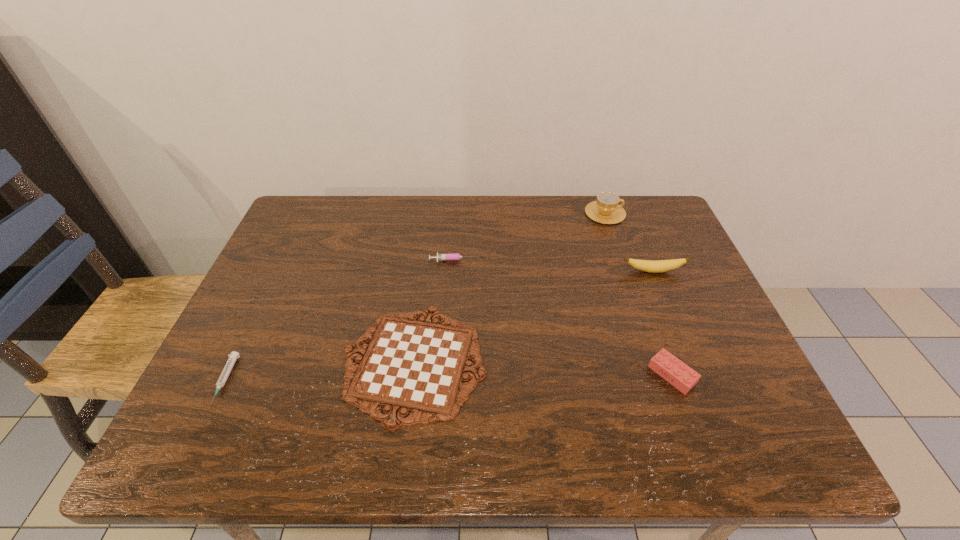
Where is `the farthest object`? This screenshot has height=540, width=960. the farthest object is located at coordinates (606, 210).

This screenshot has height=540, width=960. I want to click on the fourth nearest object, so click(x=653, y=266).

Locate an element on the screen. The height and width of the screenshot is (540, 960). banana is located at coordinates (653, 266).

Find the location of a particular element. The image size is (960, 540). Lego is located at coordinates (681, 376).

Identify the location of the farther syringe. This screenshot has height=540, width=960. (450, 256).

What are the coordinates of `the right syringe` in the screenshot? It's located at (450, 256).

You are a GUI agent. You are given a task and a screenshot of the screen. Output one action in this format:
    pyautogui.click(x=<x>, y=<y>)
    Task: Click on the shorter syringe
    
    Given the screenshot: What is the action you would take?
    pyautogui.click(x=233, y=356)

Where is `the leftmost object`? Image resolution: width=960 pixels, height=540 pixels. the leftmost object is located at coordinates (233, 356).

This screenshot has width=960, height=540. In order to click on chessboard in this screenshot , I will do `click(418, 366)`.

At what (x,y) coordinates should I click in order to perform the action: click on vacant space located 0.060m with the handle on the side of the farthest object. Please return your answer as a coordinate pair (x, y). This screenshot has width=960, height=540. Looking at the image, I should click on pos(644,213).